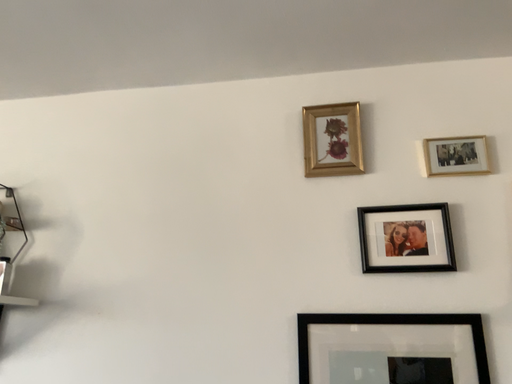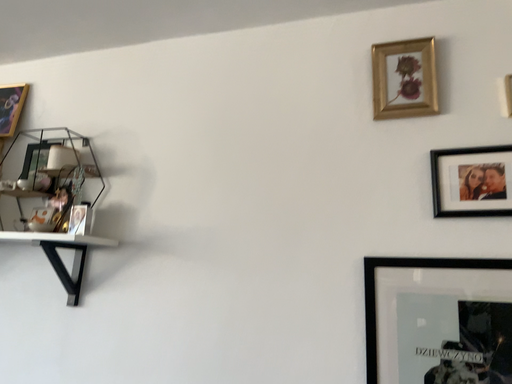
Question: Which way did the camera rotate in the video?

Choices:
 (A) rotated upward
 (B) rotated downward

Answer: (B)